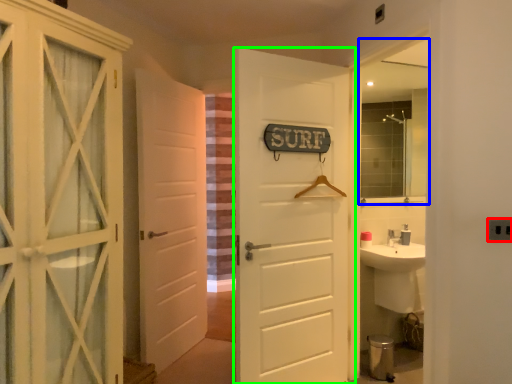
Question: Which object is the closest to the electric outlet (highlighted by a red box)? Choose among these: mirror (highlighted by a blue box) or door (highlighted by a green box).

Choices:
 (A) mirror
 (B) door

Answer: (B)